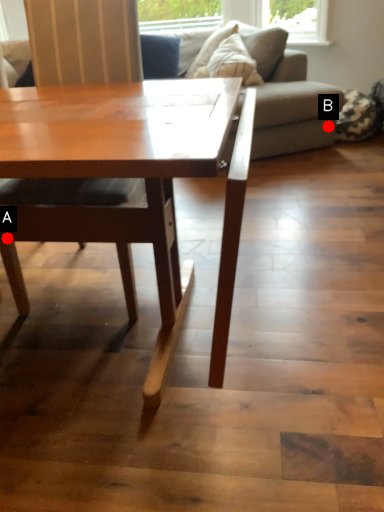
Question: Two points are circled on the image, labeled by A and B beside each circle. Among these points, which one is nearest to the camera?

Choices:
 (A) A is closer
 (B) B is closer

Answer: (A)